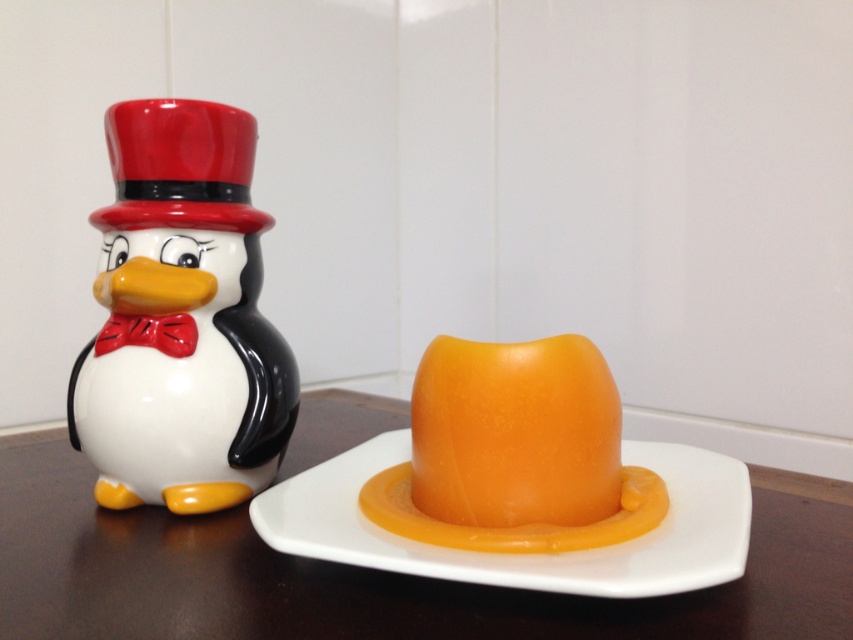
You are a delivery person who needs to pack both the glossy ceramic penguin at left and the orange glossy hat at center into a box that can only hold items up to the size of the penguin. Can both items fit in the box?

The glossy ceramic penguin at left is bigger than the orange glossy hat at center. Since the box can hold items up to the size of the penguin, both items can fit in the box.

You are arranging items on a table and need to place a new item between the orange glossy hat at center and the matte red bow tie at left. Where should you place it?

The orange glossy hat at center is to the right of the matte red bow tie at left, so placing the new item between them would require positioning it to the right of the matte red bow tie at left and to the left of the orange glossy hat at center.

You are standing in front of the image and want to know how far the point at coordinates (592, 384) is from you. Can you determine the distance?

The point at coordinates (592, 384) is 51.18 centimeters away from the viewer.